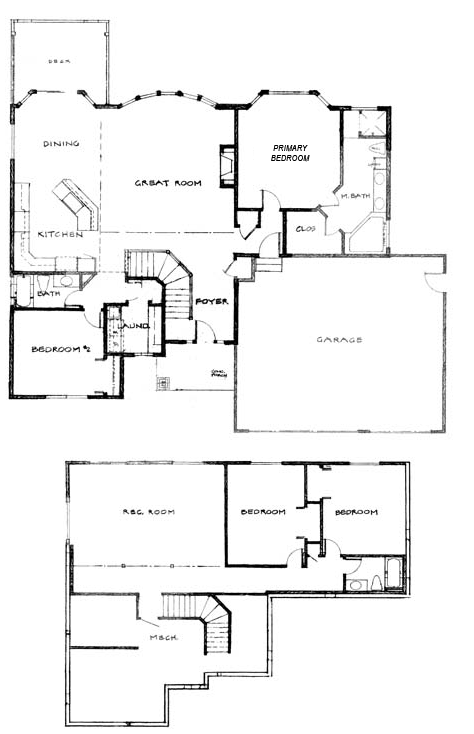
Where is `primary bedroom`? primary bedroom is located at coordinates coord(297,156).